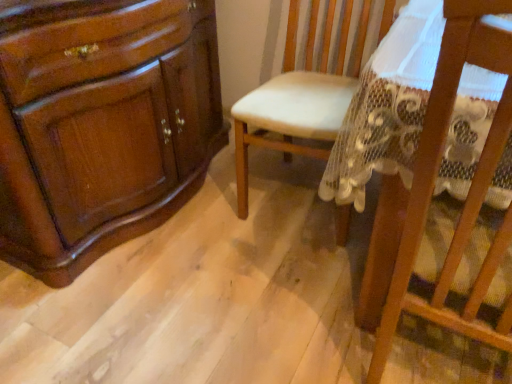
Question: Should I look upward or downward to see white leather chair at center, the 1th chair positioned from the back?

Choices:
 (A) up
 (B) down

Answer: (A)

Question: Is wooden chair at center, acting as the first chair starting from the front, outside white leather chair at center, the 1th chair positioned from the back?

Choices:
 (A) no
 (B) yes

Answer: (B)

Question: Is wooden chair at center, acting as the first chair starting from the front, further to the viewer compared to white leather chair at center, the 1th chair positioned from the back?

Choices:
 (A) no
 (B) yes

Answer: (A)

Question: Is wooden chair at center, acting as the first chair starting from the front, not near white leather chair at center, the 1th chair positioned from the back?

Choices:
 (A) yes
 (B) no

Answer: (B)

Question: Considering the relative sizes of wooden chair at center, the 2th chair from the back, and white leather chair at center, which is counted as the second chair, starting from the front, in the image provided, is wooden chair at center, the 2th chair from the back, smaller than white leather chair at center, which is counted as the second chair, starting from the front,?

Choices:
 (A) yes
 (B) no

Answer: (A)

Question: From a real-world perspective, is wooden chair at center, acting as the first chair starting from the front, located beneath white leather chair at center, the 1th chair positioned from the back?

Choices:
 (A) no
 (B) yes

Answer: (A)

Question: Is wooden chair at center, the 2th chair from the back, to the right of white leather chair at center, the 1th chair positioned from the back, from the viewer's perspective?

Choices:
 (A) yes
 (B) no

Answer: (A)

Question: Is white leather chair at center, the 1th chair positioned from the back, oriented away from wooden chair at center, acting as the first chair starting from the front?

Choices:
 (A) no
 (B) yes

Answer: (A)

Question: Would you say wooden chair at center, the 2th chair from the back, is part of white leather chair at center, which is counted as the second chair, starting from the front,'s contents?

Choices:
 (A) yes
 (B) no

Answer: (B)

Question: Is white leather chair at center, which is counted as the second chair, starting from the front, facing towards wooden chair at center, acting as the first chair starting from the front?

Choices:
 (A) no
 (B) yes

Answer: (A)

Question: From the image's perspective, is white leather chair at center, the 1th chair positioned from the back, on wooden chair at center, the 2th chair from the back?

Choices:
 (A) yes
 (B) no

Answer: (A)

Question: Can you confirm if white leather chair at center, the 1th chair positioned from the back, is wider than wooden chair at center, the 2th chair from the back?

Choices:
 (A) yes
 (B) no

Answer: (A)

Question: Is white leather chair at center, the 1th chair positioned from the back, located outside wooden chair at center, acting as the first chair starting from the front?

Choices:
 (A) no
 (B) yes

Answer: (B)

Question: Is point (466, 205) closer or farther from the camera than point (365, 1)?

Choices:
 (A) closer
 (B) farther

Answer: (A)